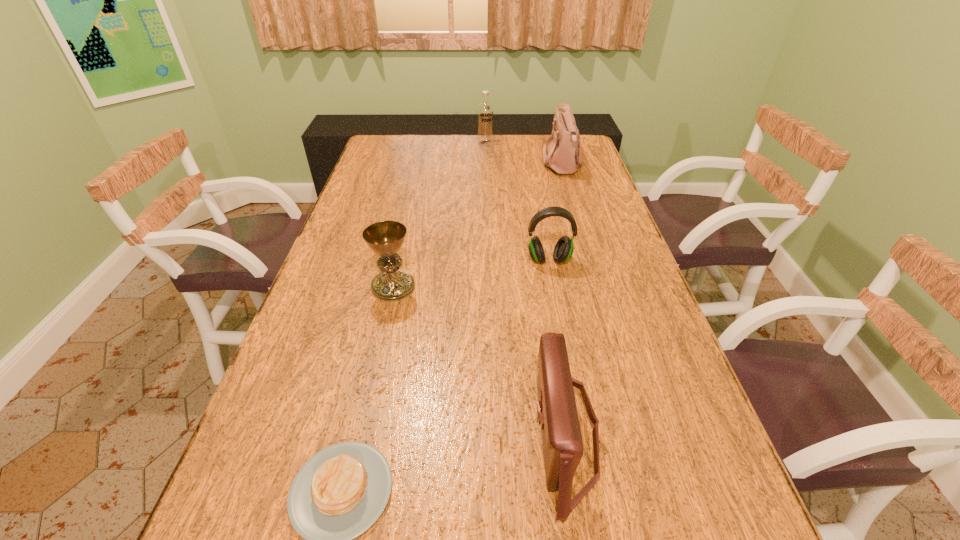
At what (x,y) coordinates should I click in order to perform the action: click on the farthest object. Please return your answer as a coordinate pair (x, y). Looking at the image, I should click on [485, 110].

This screenshot has height=540, width=960. I want to click on the tallest object, so click(485, 110).

Locate an element on the screen. the farther shoulder bag is located at coordinates (561, 157).

The width and height of the screenshot is (960, 540). Identify the location of the fifth nearest object. (561, 157).

This screenshot has height=540, width=960. Identify the location of the third nearest object. (385, 238).

Locate an element on the screen. This screenshot has height=540, width=960. the fourth nearest object is located at coordinates (563, 250).

Image resolution: width=960 pixels, height=540 pixels. In order to click on the nearer shoulder bag in this screenshot , I will do `click(557, 413)`.

Locate an element on the screen. The height and width of the screenshot is (540, 960). free space located 0.300m on the front label of the vodka is located at coordinates pyautogui.click(x=486, y=184).

Find the location of a particular element. Image resolution: width=960 pixels, height=540 pixels. vacant region located 0.350m on the front pocket of the farther shoulder bag is located at coordinates click(x=449, y=164).

You are a GUI agent. You are given a task and a screenshot of the screen. Output one action in this format:
    pyautogui.click(x=<x>, y=<y>)
    Task: Click on the vacant region located 0.190m on the front pocket of the farther shoulder bag
    
    Given the screenshot: What is the action you would take?
    pyautogui.click(x=492, y=164)